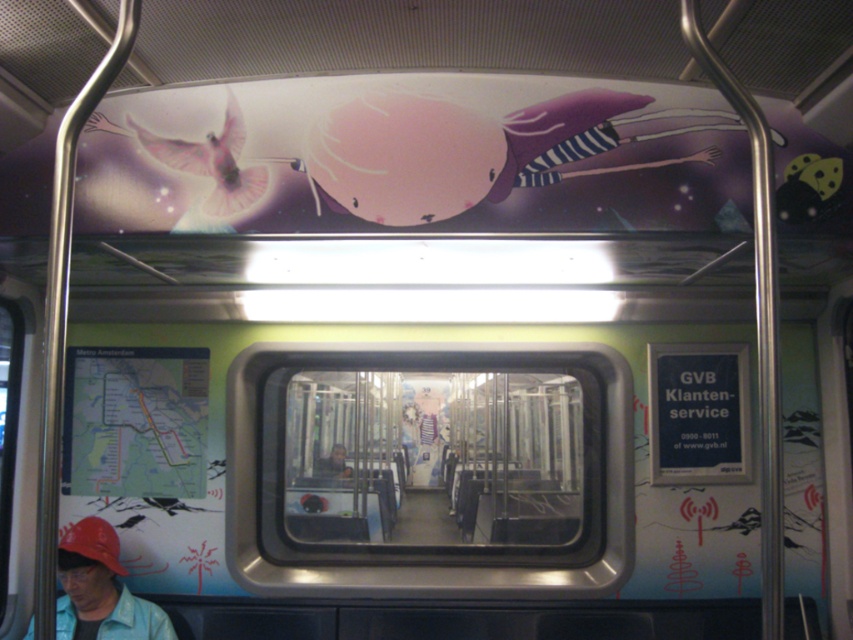
Which of these two, matte red hat at lower left or matte red baseball cap at lower left, stands shorter?

matte red baseball cap at lower left is shorter.

Which is in front, point (115, 579) or point (85, 524)?

Point (85, 524)

You are a GUI agent. You are given a task and a screenshot of the screen. Output one action in this format:
    pyautogui.click(x=<x>, y=<y>)
    Task: Click on the matte red hat at lower left
    
    Given the screenshot: What is the action you would take?
    pyautogui.click(x=100, y=589)

Identify the location of matte red hat at lower left. (100, 589).